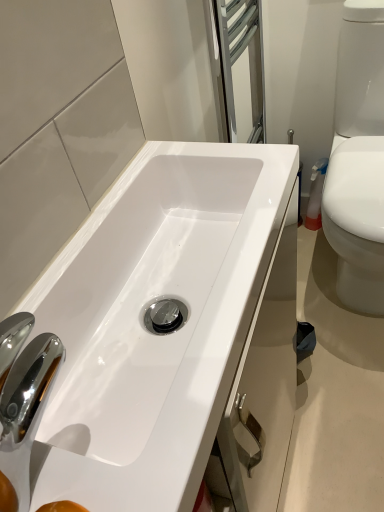
What do you see at coordinates (173, 334) in the screenshot?
I see `white glossy sink at center` at bounding box center [173, 334].

What is the approximate height of white glossy sink at center?

The height of white glossy sink at center is 31.79 inches.

The image size is (384, 512). Identify the location of white glossy sink at center. (173, 334).

This screenshot has height=512, width=384. I want to click on white glossy sink at center, so click(173, 334).